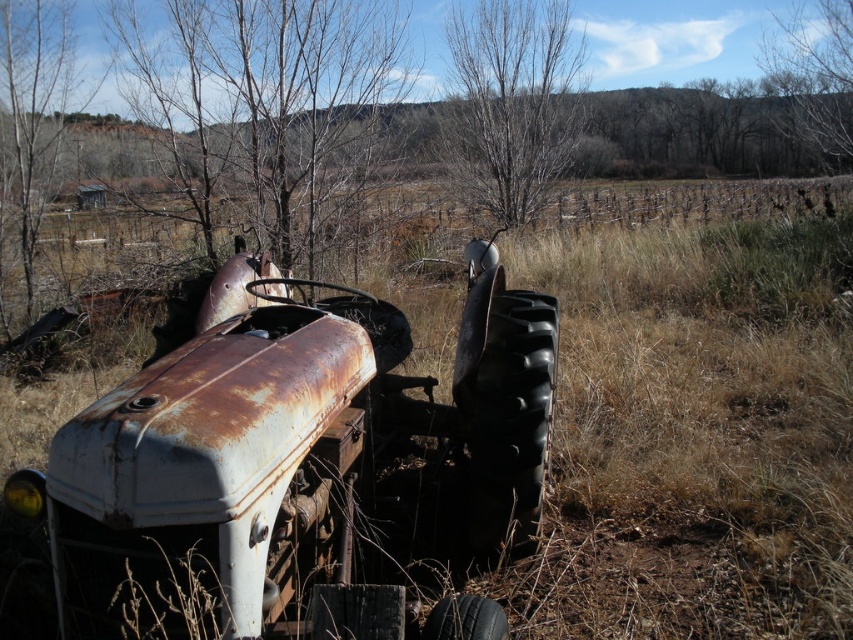
Question: Based on their relative distances, which object is nearer to the bare branches at upper right?

Choices:
 (A) rusty metal tractor at center
 (B) bare branches at center
 (C) bare wood tree at left

Answer: (B)

Question: Among these objects, which one is farthest from the camera?

Choices:
 (A) bare branches at upper right
 (B) bare wood tree at left

Answer: (A)

Question: Considering the relative positions of rusty metal tractor at center and bare branches at upper right in the image provided, where is rusty metal tractor at center located with respect to bare branches at upper right?

Choices:
 (A) above
 (B) below

Answer: (B)

Question: Is bare branches at center further to camera compared to bare branches at upper right?

Choices:
 (A) no
 (B) yes

Answer: (B)

Question: Is bare wood tree at left below bare branches at upper right?

Choices:
 (A) yes
 (B) no

Answer: (A)

Question: Which object is closer to the camera taking this photo?

Choices:
 (A) bare branches at upper right
 (B) bare branches at center

Answer: (A)